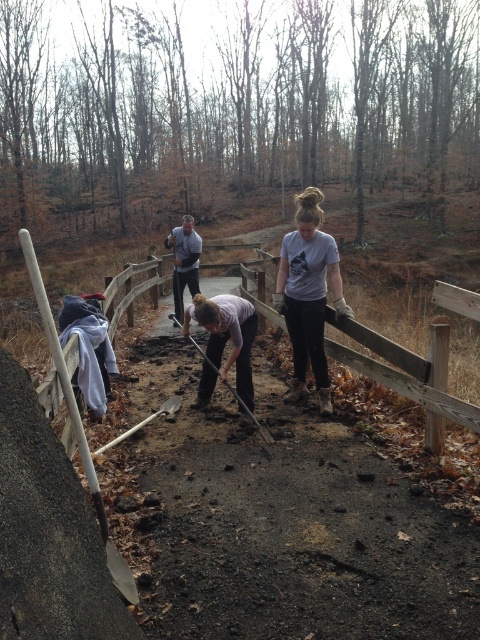
In the scene shown: Is light gray t-shirt at center shorter than dark gray pants at center?

No, light gray t-shirt at center is not shorter than dark gray pants at center.

Does light gray t-shirt at center appear over dark gray pants at center?

No.

What do you see at coordinates (309, 294) in the screenshot?
I see `light gray t-shirt at center` at bounding box center [309, 294].

The image size is (480, 640). Find the location of `light gray t-shirt at center`. light gray t-shirt at center is located at coordinates (309, 294).

Does light gray fabric shirt at center come behind dark gray pants at center?

No, light gray fabric shirt at center is in front of dark gray pants at center.

Consider the image. Can you confirm if light gray fabric shirt at center is smaller than dark gray pants at center?

Yes, light gray fabric shirt at center is smaller than dark gray pants at center.

Is point (239, 308) positioned after point (177, 262)?

No, (239, 308) is in front of (177, 262).

Locate an element on the screen. The height and width of the screenshot is (640, 480). light gray fabric shirt at center is located at coordinates (227, 336).

Is light gray t-shirt at center above light gray fabric shirt at center?

Yes, light gray t-shirt at center is above light gray fabric shirt at center.

Image resolution: width=480 pixels, height=640 pixels. I want to click on light gray t-shirt at center, so click(x=309, y=294).

The image size is (480, 640). Find the location of `light gray t-shirt at center`. light gray t-shirt at center is located at coordinates (309, 294).